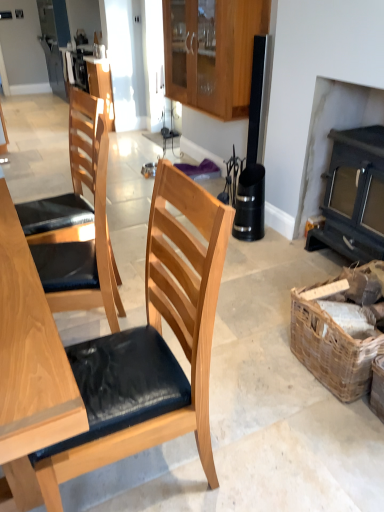
The width and height of the screenshot is (384, 512). What are the coordinates of `vacant region to the left of dark gray wood fireplace at right` in the screenshot? It's located at (282, 267).